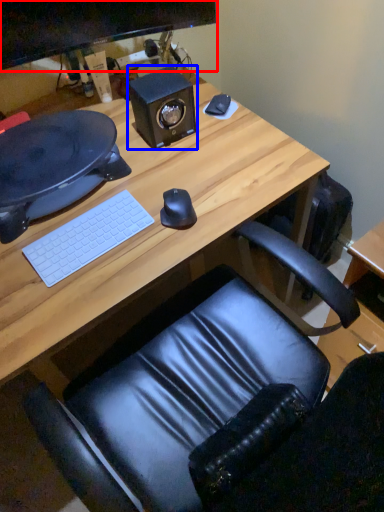
Question: Which of the following is the closest to the observer, computer monitor (highlighted by a red box) or speaker (highlighted by a blue box)?

Choices:
 (A) computer monitor
 (B) speaker

Answer: (A)